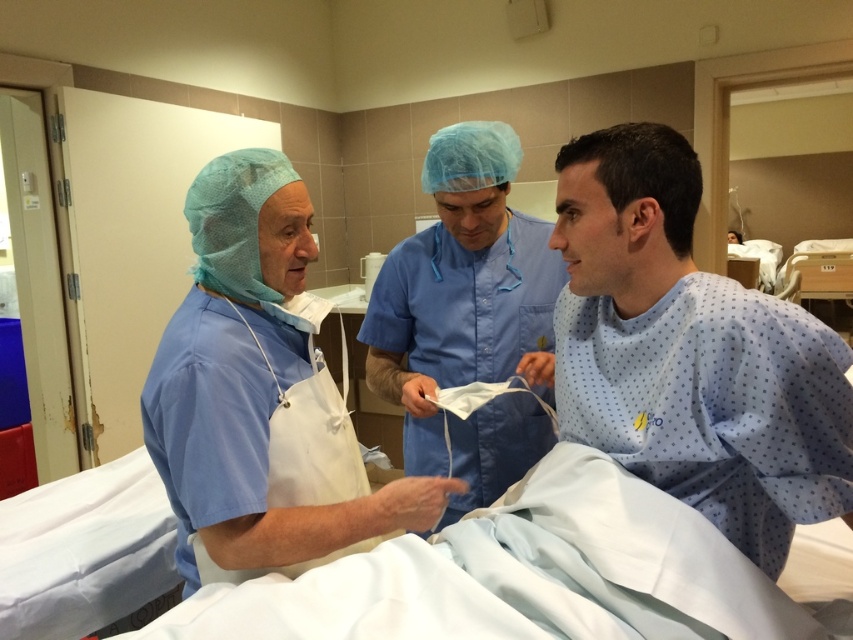
Question: Is white fabric hospital bed at center closer to the viewer compared to blue smooth scrubs at left?

Choices:
 (A) yes
 (B) no

Answer: (A)

Question: Can you confirm if white fabric hospital bed at center is wider than blue smooth scrubs at center?

Choices:
 (A) no
 (B) yes

Answer: (B)

Question: Which of the following is the farthest from the observer?

Choices:
 (A) blue smooth scrubs at left
 (B) white fabric hospital bed at center
 (C) light blue fabric at center
 (D) blue smooth scrubs at center

Answer: (D)

Question: Which is farther from the blue smooth scrubs at center?

Choices:
 (A) white fabric hospital bed at center
 (B) blue smooth scrubs at left
 (C) light blue fabric at center

Answer: (A)

Question: Considering the relative positions of light blue fabric at center and blue smooth scrubs at left in the image provided, where is light blue fabric at center located with respect to blue smooth scrubs at left?

Choices:
 (A) left
 (B) right

Answer: (B)

Question: Based on their relative distances, which object is farther from the blue smooth scrubs at left?

Choices:
 (A) white fabric hospital bed at center
 (B) light blue fabric at center
 (C) blue smooth scrubs at center

Answer: (B)